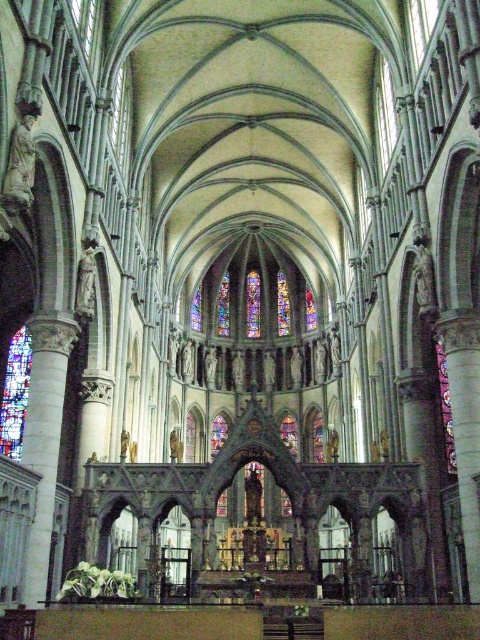
You are standing in the nave of the cathedral and notice two stained glass artworks. One is labeled as the stained glass window at center, and the other is labeled as the stained glass at center. According to their positions, which one is positioned lower?

The stained glass window at center is located below stained glass at center, so the stained glass window at center is positioned lower.

You are standing at the entrance of the cathedral and looking towards the altar. There are two stained glass features in your view. Which one is closer to you, the transparent stained glass at upper center or the stained glass window at center?

The transparent stained glass at upper center is closer to you because the stained glass window at center is behind it.

You are an architect visiting the cathedral and want to install a new decorative element. You have two options for placement. The first is near the transparent stained glass at upper center, and the second is near the stained glass window at center. Which location offers more space for your decoration?

The stained glass window at center offers more space for your decoration because it is larger than the transparent stained glass at upper center.